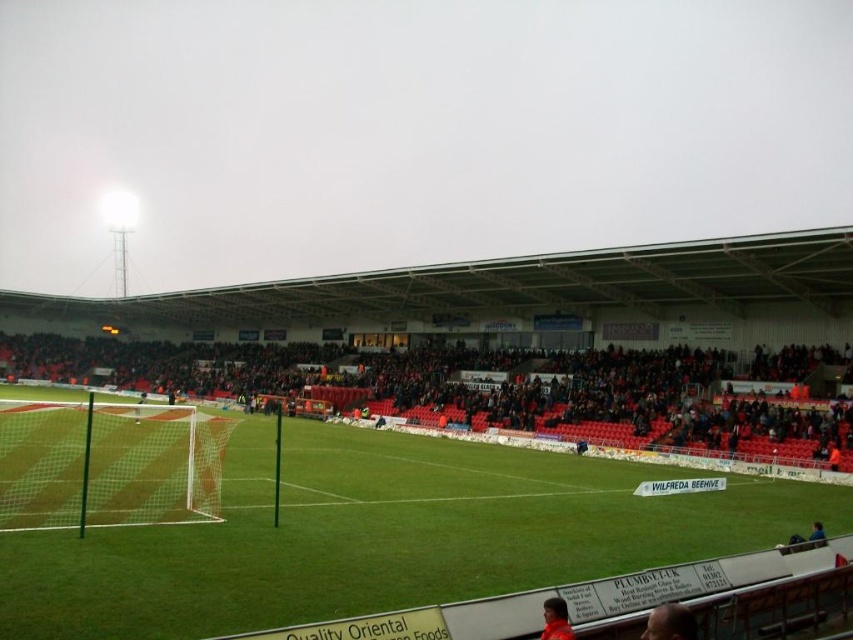
In the scene shown: You are a photographer trying to capture a clear shot of the smooth brown hair at lower right without the green grass football field at center blocking the view. Is this possible from your current position?

The smooth brown hair at lower right is behind the green grass football field at center, so it is currently blocked by the field. To get a clear shot, you would need to adjust your position to move around the field or use a different angle where the hair is not obscured.